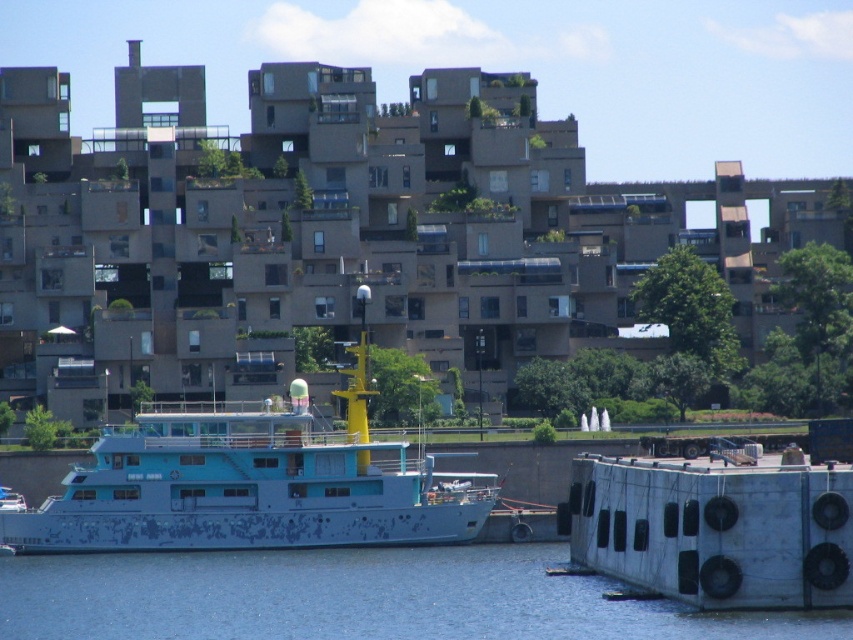
Question: Which point is farther to the camera?

Choices:
 (A) blue faded paint boat at center
 (B) blue water at lower center

Answer: (A)

Question: Is blue water at lower center positioned at the back of blue faded paint boat at center?

Choices:
 (A) yes
 (B) no

Answer: (B)

Question: In this image, where is blue water at lower center located relative to blue faded paint boat at center?

Choices:
 (A) right
 (B) left

Answer: (A)

Question: Is blue water at lower center to the left of blue faded paint boat at center from the viewer's perspective?

Choices:
 (A) yes
 (B) no

Answer: (B)

Question: Among these points, which one is nearest to the camera?

Choices:
 (A) (281, 497)
 (B) (15, 602)

Answer: (B)